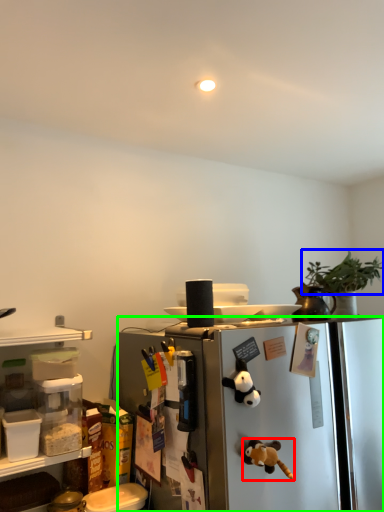
Question: Considering the real-world distances, which object is closest to toy (highlighted by a red box)? plant (highlighted by a blue box) or refrigerator (highlighted by a green box).

Choices:
 (A) plant
 (B) refrigerator

Answer: (B)